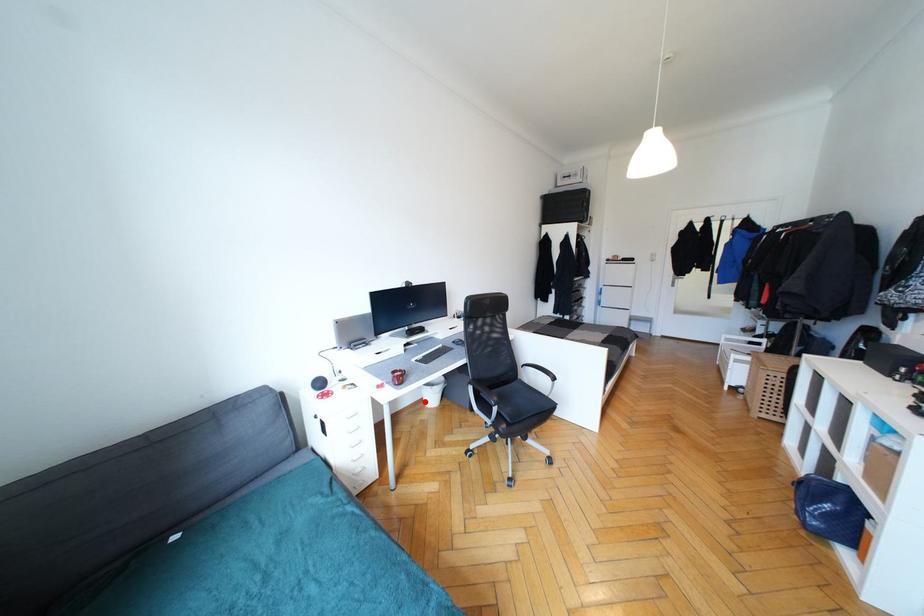
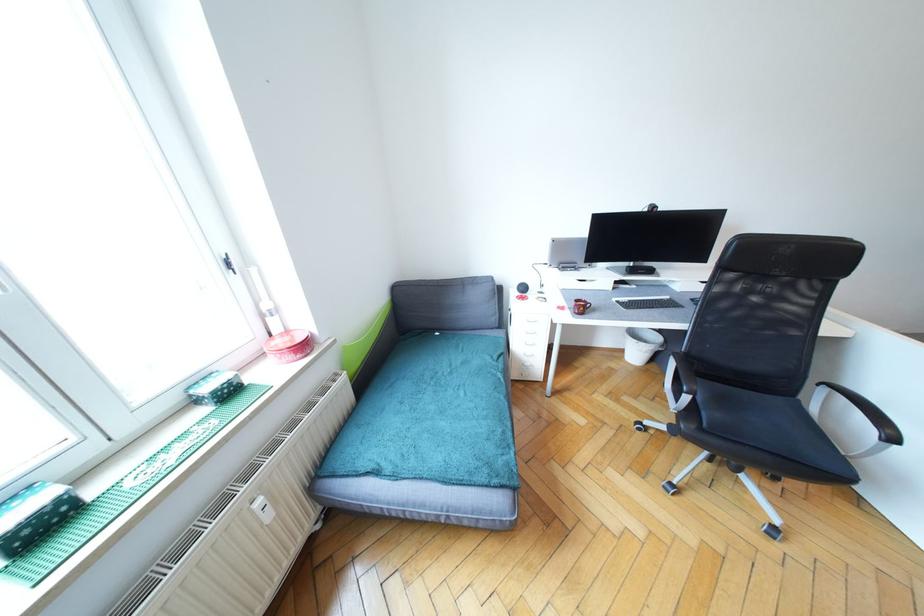
Question: I am providing you with two images of the same scene from different viewpoints. A red point is marked on the first image. Can you still see the location of the red point in image 2?

Choices:
 (A) Yes
 (B) No

Answer: (A)